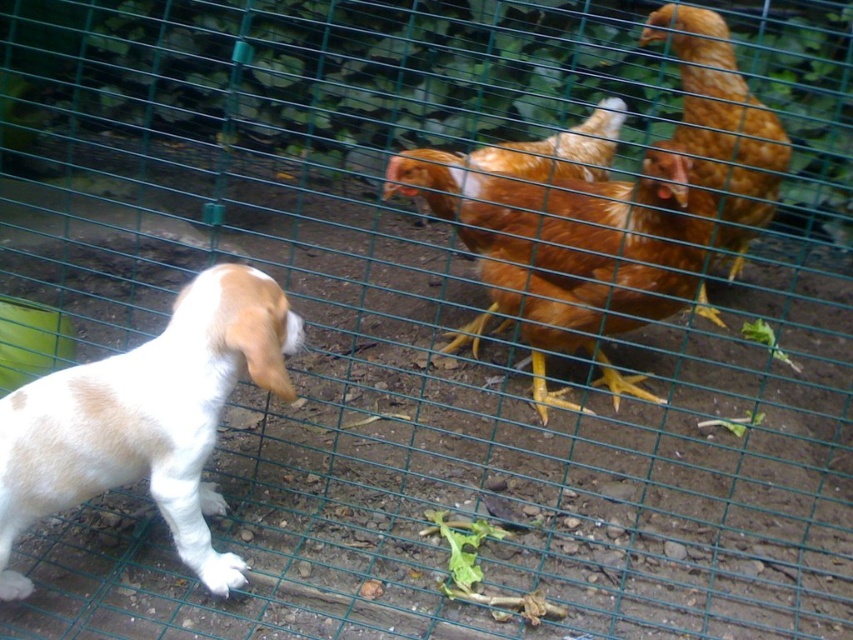
Which is more to the right, golden brown feathers at center or golden feathered chicken at upper right?

From the viewer's perspective, golden feathered chicken at upper right appears more on the right side.

Is point (605, 228) behind point (712, 129)?

That is True.

Identify the location of golden brown feathers at center. coord(573,250).

Who is higher up, white fur dog at left or golden brown feathers at center?

golden brown feathers at center is higher up.

Is white fur dog at left to the right of golden brown feathers at center from the viewer's perspective?

Incorrect, white fur dog at left is not on the right side of golden brown feathers at center.

Measure the distance between point (68, 428) and camera.

1.07 meters

Find the location of a particular element. The image size is (853, 640). white fur dog at left is located at coordinates (148, 419).

The width and height of the screenshot is (853, 640). What are the coordinates of `white fur dog at left` in the screenshot? It's located at pyautogui.click(x=148, y=419).

Does point (204, 355) come farther from viewer compared to point (689, 145)?

No, it is not.

Is point (216, 378) positioned behind point (724, 44)?

No, it is not.

The height and width of the screenshot is (640, 853). Find the location of `white fur dog at left`. white fur dog at left is located at coordinates (148, 419).